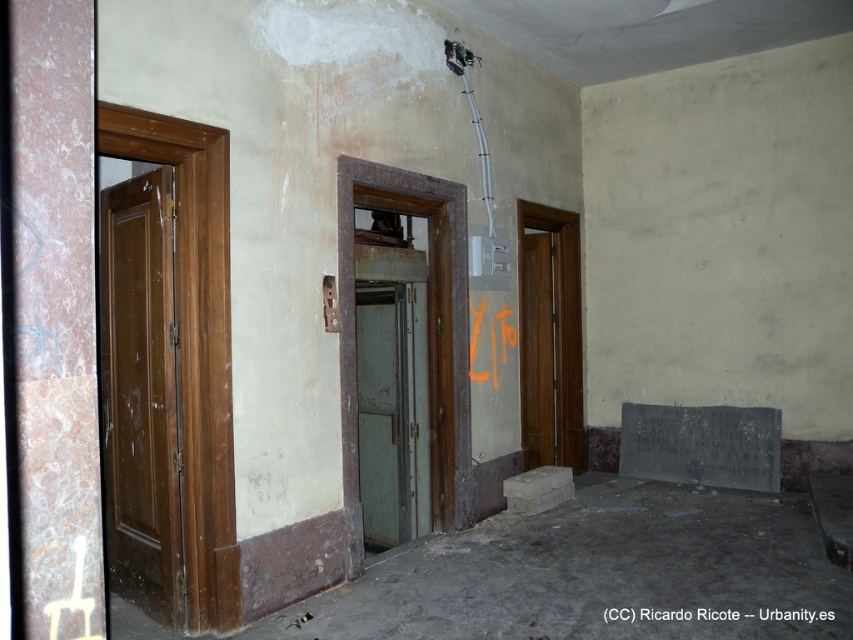
Question: Does matte brown door at left come behind brown wooden door at center right?

Choices:
 (A) no
 (B) yes

Answer: (A)

Question: Which object is farther from the camera taking this photo?

Choices:
 (A) matte brown door at left
 (B) brown wooden door at center right

Answer: (B)

Question: Is matte brown door at left positioned behind green matte door at center?

Choices:
 (A) yes
 (B) no

Answer: (B)

Question: Which of the following is the closest to the observer?

Choices:
 (A) coord(157,259)
 (B) coord(405,289)

Answer: (A)

Question: Considering the relative positions of matte brown door at left and green matte door at center in the image provided, where is matte brown door at left located with respect to green matte door at center?

Choices:
 (A) above
 (B) below

Answer: (A)

Question: Which point is closer to the camera taking this photo?

Choices:
 (A) (570, 364)
 (B) (402, 422)
 (C) (123, 400)

Answer: (C)